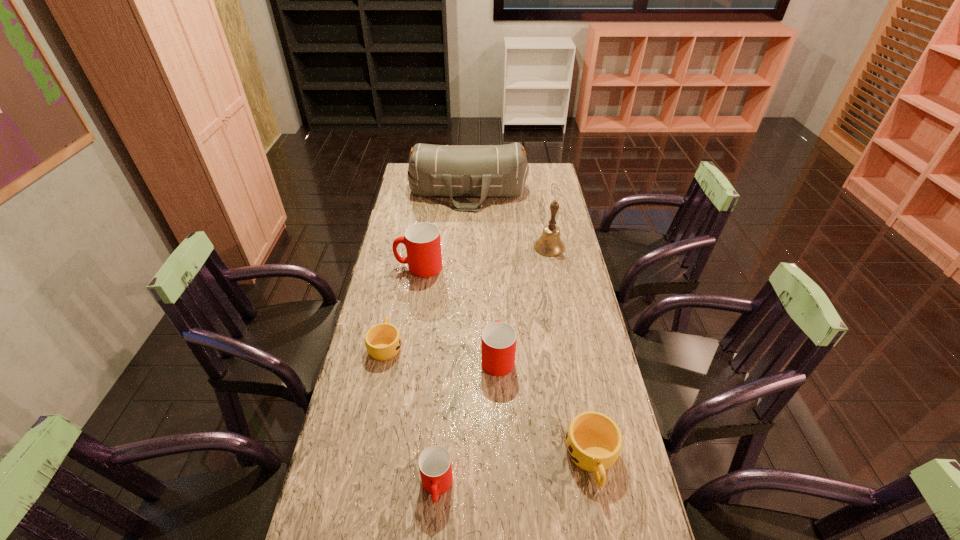
Locate an element on the screen. duffel bag is located at coordinates (483, 171).

I want to click on bell, so click(x=549, y=244).

Locate an element on the screen. Image resolution: width=960 pixels, height=540 pixels. the biggest red cup is located at coordinates 422,240.

In order to click on the fifth shortest object in this screenshot , I will do `click(422, 240)`.

Where is `the fourth cup from left to right`? The height and width of the screenshot is (540, 960). the fourth cup from left to right is located at coordinates (498, 339).

The image size is (960, 540). Find the location of `the rightmost red cup`. the rightmost red cup is located at coordinates (498, 339).

The height and width of the screenshot is (540, 960). I want to click on the third shortest cup, so click(435, 466).

Where is `the third shortest object`? the third shortest object is located at coordinates (435, 466).

Locate an element on the screen. the rightmost cup is located at coordinates (593, 440).

Where is `the sixth tallest object`? This screenshot has width=960, height=540. the sixth tallest object is located at coordinates (593, 440).